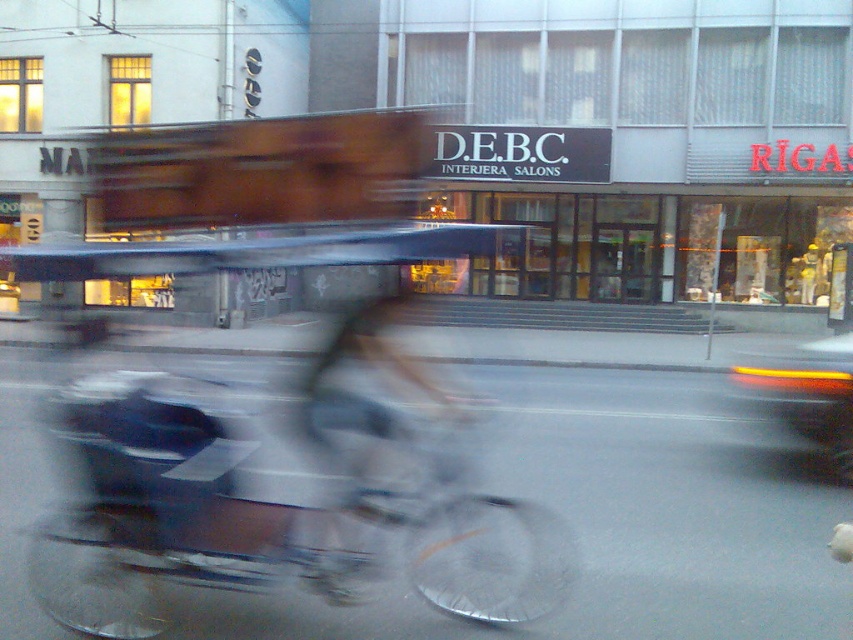
Can you confirm if gray fabric jacket at center is positioned above matte orange tail light at right?

No, gray fabric jacket at center is not above matte orange tail light at right.

Is point (318, 541) farther from camera compared to point (846, 336)?

No, it is not.

I want to click on gray fabric jacket at center, so click(372, 429).

Who is lower down, metallic silver bicycle at center or matte orange tail light at right?

metallic silver bicycle at center is lower down.

Does metallic silver bicycle at center have a lesser height compared to matte orange tail light at right?

Yes, metallic silver bicycle at center is shorter than matte orange tail light at right.

At what (x,y) coordinates should I click in order to perform the action: click on metallic silver bicycle at center. Please return your answer as a coordinate pair (x, y). Looking at the image, I should click on (271, 516).

Who is shorter, metallic silver bicycle at center or gray fabric jacket at center?

With less height is metallic silver bicycle at center.

Is metallic silver bicycle at center behind gray fabric jacket at center?

Yes, metallic silver bicycle at center is behind gray fabric jacket at center.

Is point (461, 561) farther from camera compared to point (378, 419)?

That is True.

Where is `metallic silver bicycle at center`? This screenshot has height=640, width=853. metallic silver bicycle at center is located at coordinates (271, 516).